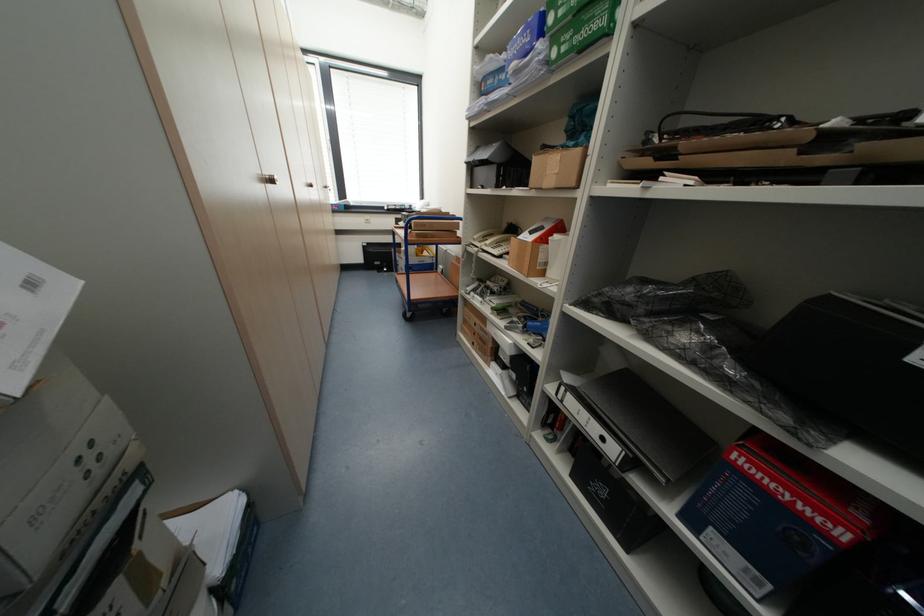
Find where to lift the telephone handset. Please return your answer as a coordinate pair (x, y).

(494, 240)